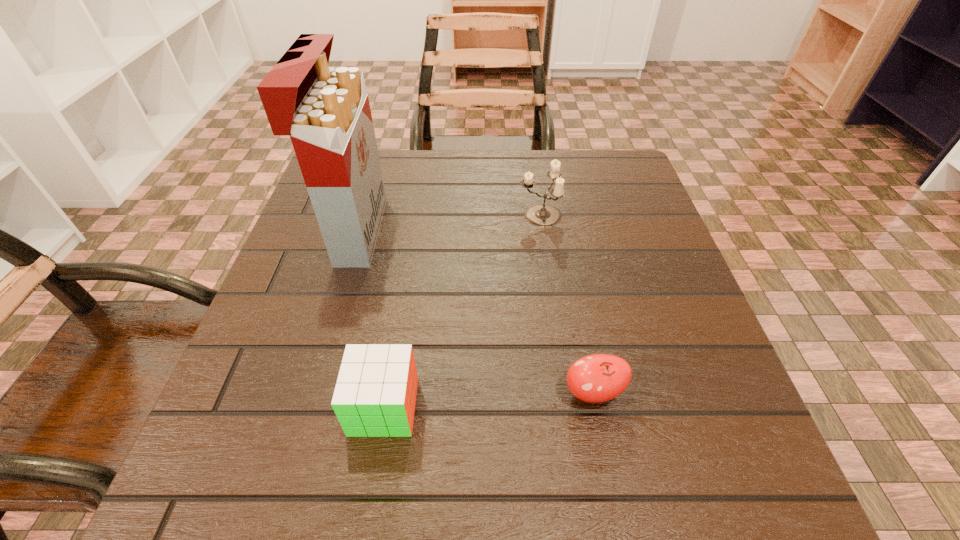
You are a GUI agent. You are given a task and a screenshot of the screen. Output one action in this format:
    pyautogui.click(x=<x>, y=<y>)
    Task: Click on the candle holder present at the far edge
    
    Given the screenshot: What is the action you would take?
    [541, 215]

You are a GUI agent. You are given a task and a screenshot of the screen. Output one action in this format:
    pyautogui.click(x=<x>, y=<y>)
    Task: Click on the object at the left edge
    Image resolution: width=960 pixels, height=540 pixels.
    Given the screenshot: What is the action you would take?
    pyautogui.click(x=325, y=110)

Identify the location of object that is at the far left corner. (325, 110).

You are a GUI agent. You are given a task and a screenshot of the screen. Output one action in this format:
    pyautogui.click(x=<x>, y=<y>)
    Task: Click on the free space at the far edge of the desktop
    The image size is (960, 540).
    Given the screenshot: What is the action you would take?
    pyautogui.click(x=470, y=183)

Locate an element on the screen. Image resolution: width=960 pixels, height=540 pixels. free spot at the near edge of the desktop is located at coordinates (313, 480).

Locate an element on the screen. vacant region at the left edge of the desktop is located at coordinates (305, 283).

The height and width of the screenshot is (540, 960). I want to click on free location at the right edge, so click(632, 409).

At what (x,y) coordinates should I click in order to perform the action: click on vacant point at the near left corner. Please return your answer as a coordinate pair (x, y). Looking at the image, I should click on (192, 488).

In the image, there is a desktop. At what (x,y) coordinates should I click in order to perform the action: click on vacant space at the far right corner. Please return your answer as a coordinate pair (x, y). The height and width of the screenshot is (540, 960). Looking at the image, I should click on (590, 179).

Identify the location of vacant space at the near right corner of the desktop. The width and height of the screenshot is (960, 540). (745, 476).